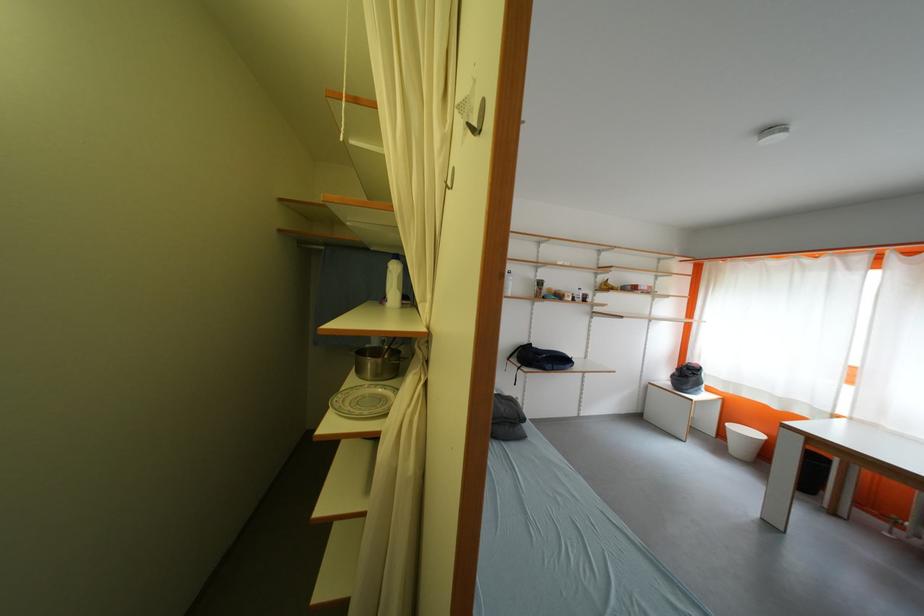
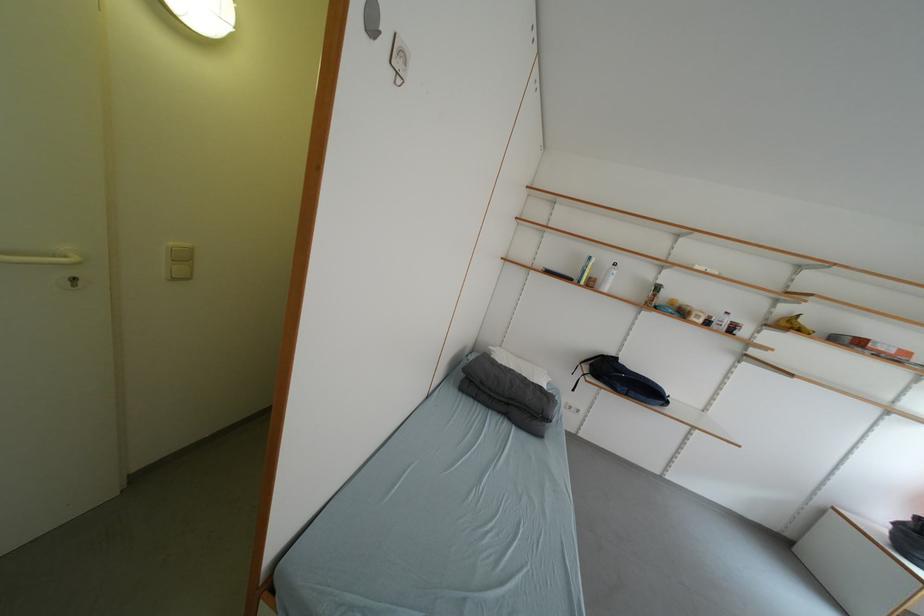
Where in the second image is the point corresponding to (x=614, y=290) from the first image?

(797, 328)